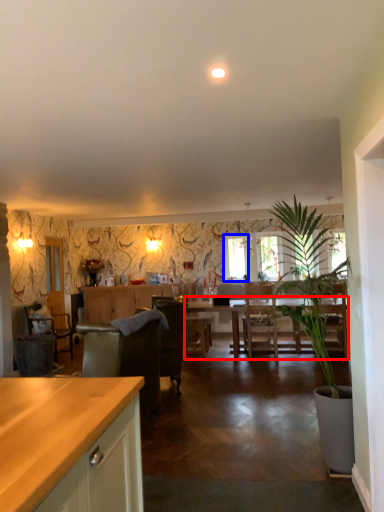
Question: Which of the following is the farthest to the observer, kitchen & dining room table (highlighted by a red box) or window screen (highlighted by a blue box)?

Choices:
 (A) kitchen & dining room table
 (B) window screen

Answer: (B)